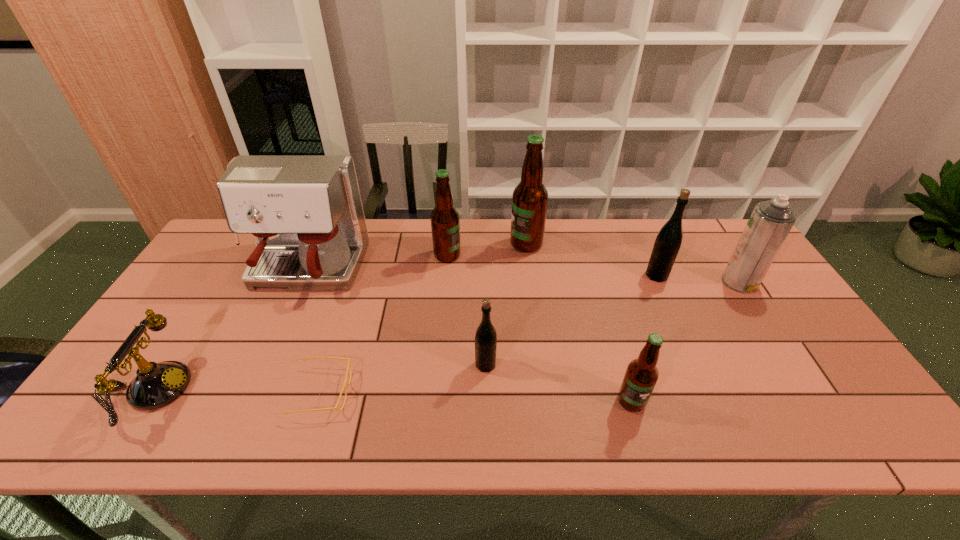
In the image, there is a desktop. Identify the location of vacant area at the near right corner. (851, 423).

Where is `free space between the second shortest object and the fourth beer bottle from right to left`? This screenshot has width=960, height=540. free space between the second shortest object and the fourth beer bottle from right to left is located at coordinates (319, 377).

Find the location of `free space between the tallest beer bottle and the right green beer bottle`. free space between the tallest beer bottle and the right green beer bottle is located at coordinates (591, 260).

The height and width of the screenshot is (540, 960). Identify the location of free space between the beige spectacles and the seventh object from left to right. (477, 397).

This screenshot has width=960, height=540. I want to click on free space between the leftmost beer bottle and the smallest brown beer bottle, so click(x=540, y=328).

At what (x,y) coordinates should I click in order to perform the action: click on free space between the rightmost object and the sixth object from left to right. Please return your answer as a coordinate pair (x, y). This screenshot has height=540, width=960. Looking at the image, I should click on (633, 263).

Image resolution: width=960 pixels, height=540 pixels. I want to click on unoccupied position between the fourth object from right to left and the rightmost object, so click(x=633, y=263).

Locate an element on the screen. The width and height of the screenshot is (960, 540). free space between the tallest beer bottle and the fifth object from right to left is located at coordinates (506, 305).

Identify the location of vacant point located between the leftmost beer bottle and the telephone. (300, 323).

This screenshot has width=960, height=540. What are the coordinates of `vacant space that is in between the rightmost object and the fourth beer bottle from right to left` in the screenshot? It's located at (612, 323).